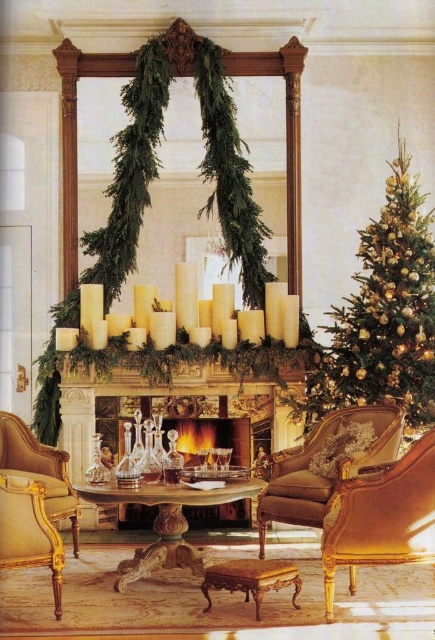
You are a guest entering the living room and want to sit as close as possible to the fireplace. Which armchair should you choose between the brown leather armchair at center and the gold wood armchair at lower left?

The brown leather armchair at center is above the gold wood armchair at lower left, so it is closer to the fireplace. Therefore, you should choose the brown leather armchair at center.

Consider the image. You are a guest standing in the living room and want to place a 1.2 meter tall Christmas tree between the gold glittering ornaments at right and the gold wood armchair at lower left. Can the tree fit vertically in that space?

The gold glittering ornaments at right is taller than gold wood armchair at lower left. Since the tree is 1.2 meters tall, it may not fit vertically if the space between the two objects is constrained by their heights. However, the description only mentions height comparison, not the vertical space available. Without information on the vertical clearance, we cannot confirm if the tree will fit.

You are standing in the living room and want to place a small decorative item on the closest point between point (323, 438) and point (3, 480). Which point should you choose?

Point (323, 438) is further to the viewer than point (3, 480), so the closest point to you is point (3, 480). You should place the decorative item there.